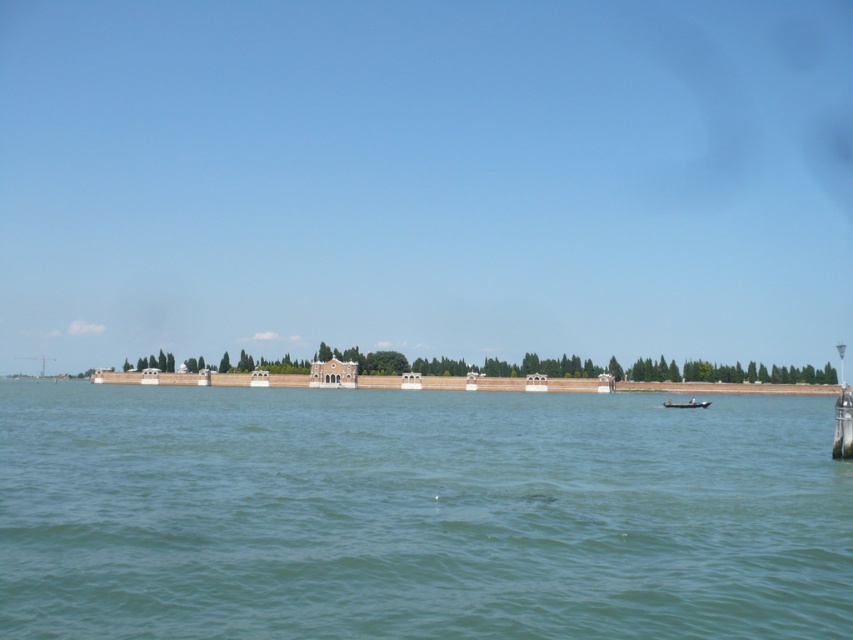
You are standing at the edge of the waterway scene described, and you want to reach a specific point marked at coordinates point (799, 406). Given that you can walk at a speed of 1.2 meters per second, how many seconds will it take you to reach that point?

The distance between point (799, 406) and the viewer is 103.53 meters. At a walking speed of 1.2 meters per second, it would take approximately 86.28 seconds to reach the point. This is calculated by dividing the distance by the speed.

You are standing on the wooden boat at lower right and want to reach the green water at center. Which direction should you move in to get there?

You should move to the left to reach the green water at center since it is located to the left of the wooden boat at lower right.

You are navigating a small boat along the waterway and want to pass between the two points marked on the map. Based on their positions, can you determine if the path between point (440, 378) and point (676, 404) is clear of obstacles?

Point (440, 378) is behind point (676, 404), so the path between them might be obstructed by the structure or trees in the middle ground, making it unclear if the path is completely clear of obstacles.